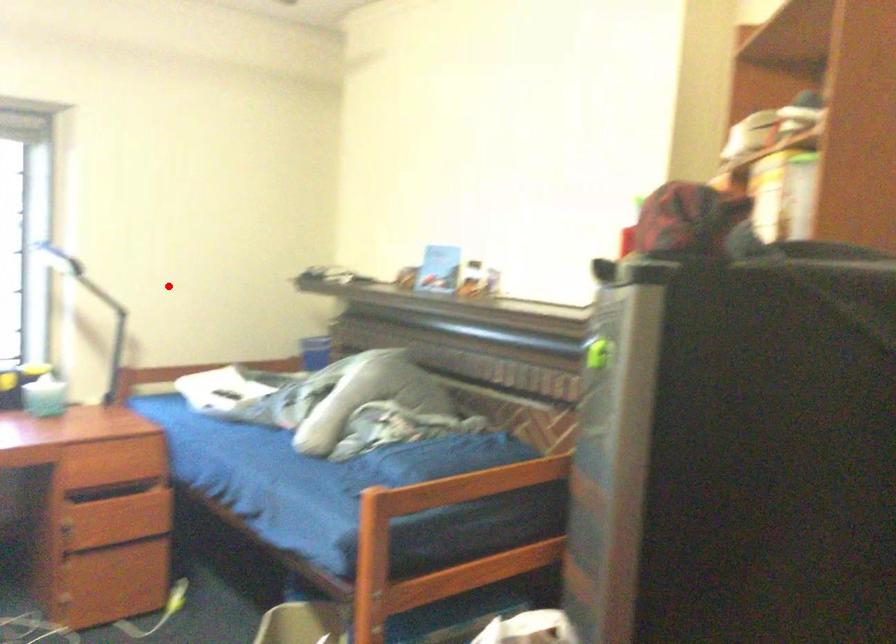
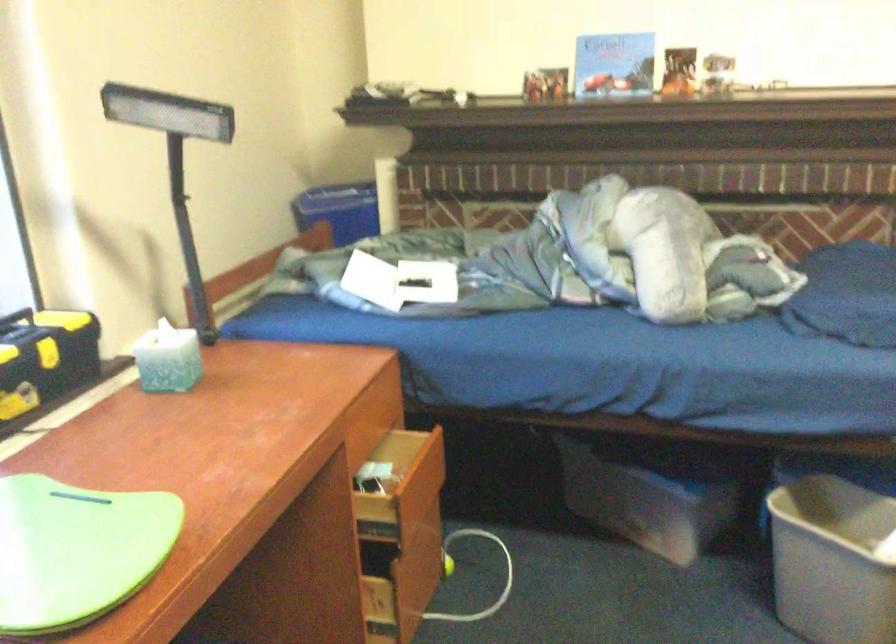
Where in the second image is the point corresponding to the highlighted location from the first image?

(176, 162)